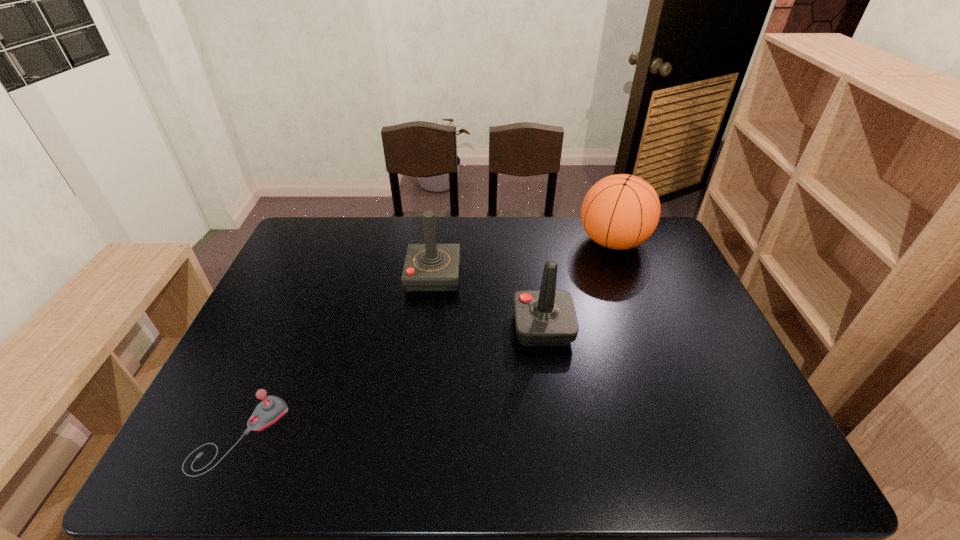
This screenshot has width=960, height=540. In order to click on free location located on the back of the shortest joystick in this screenshot , I will do `click(297, 307)`.

This screenshot has width=960, height=540. In order to click on object that is at the far edge in this screenshot , I will do `click(621, 211)`.

Where is `object present at the near edge`? Image resolution: width=960 pixels, height=540 pixels. object present at the near edge is located at coordinates (272, 408).

Where is `object located in the left edge section of the desktop`? This screenshot has width=960, height=540. object located in the left edge section of the desktop is located at coordinates (272, 408).

Identify the location of object at the right edge. click(x=621, y=211).

Identify the location of object at the near left corner. (272, 408).

Identify the location of object positioned at the far right corner. Image resolution: width=960 pixels, height=540 pixels. (621, 211).

Locate an element on the screen. vacant space at the far edge of the desktop is located at coordinates click(x=516, y=233).

The height and width of the screenshot is (540, 960). I want to click on free space at the near edge of the desktop, so click(680, 477).

Identify the location of free space at the left edge. The width and height of the screenshot is (960, 540). (284, 285).